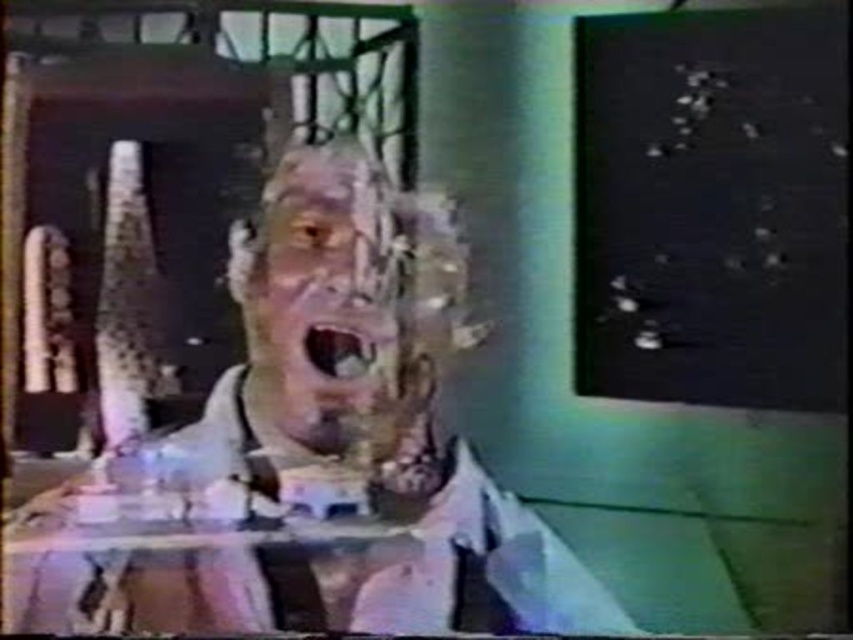
Is point (349, 620) farther from camera compared to point (366, 228)?

That is False.

Is matte plastic mannequin head at center to the left of matte textured face at center from the viewer's perspective?

Incorrect, matte plastic mannequin head at center is not on the left side of matte textured face at center.

What do you see at coordinates (308, 451) in the screenshot? This screenshot has width=853, height=640. I see `matte plastic mannequin head at center` at bounding box center [308, 451].

Find the location of a particular element. The height and width of the screenshot is (640, 853). matte plastic mannequin head at center is located at coordinates (308, 451).

Between matte textured face at center and matte plastic mouth at center, which one is positioned lower?

Positioned lower is matte plastic mouth at center.

Locate an element on the screen. This screenshot has height=640, width=853. matte textured face at center is located at coordinates (322, 298).

Can you confirm if matte plastic mannequin head at center is positioned above matte plastic mouth at center?

No.

Is point (572, 609) positioned behind point (363, 365)?

That is False.

Between point (310, 481) and point (334, 365), which one is positioned in front?

Positioned in front is point (310, 481).

The image size is (853, 640). I want to click on matte plastic mannequin head at center, so click(308, 451).